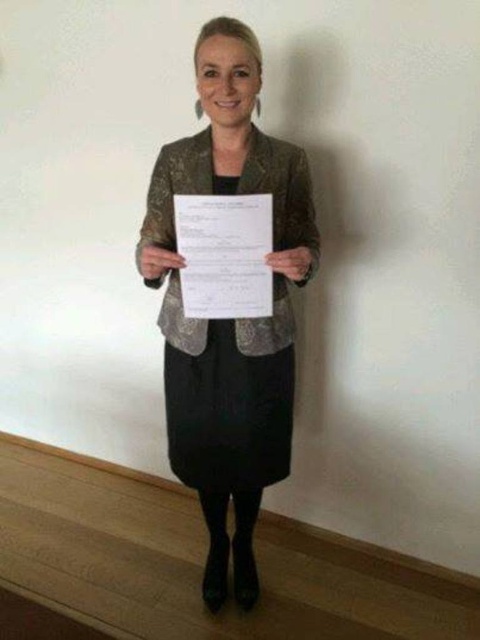
You are a photographer adjusting your camera settings to capture the woman in the scene. The metallic gold blazer at center and the white paper at center are both important subjects. Based on their positions, which object should you focus on first to ensure proper depth of field?

The metallic gold blazer at center is below the white paper at center, so you should focus on the metallic gold blazer at center first to ensure proper depth of field since it is closer to the camera.

You are an assistant helping someone choose an outfit. The person wants to ensure their metallic gold blazer at center doesn not overpower the white paper at center they are holding. Based on the scene, what advice would you give?

The metallic gold blazer at center is taller than the white paper at center, so to prevent the blazer from overpowering the paper, suggest holding the paper higher or adjusting the blazer to a lower position.

You are a photographer setting up for a portrait session. The subject is wearing a metallic gold blazer at center and is standing 1.49 meters away from you. Your camera has a focal length of 50mm. To ensure the blazer fills the frame adequately, should you move closer or farther away?

The metallic gold blazer at center is 1.49 meters away from the viewer. Since the camera has a 50mm focal length, which is considered standard, moving closer would increase the size of the blazer in the frame, while moving farther would decrease it. To fill the frame adequately, you should move slightly closer to the subject.